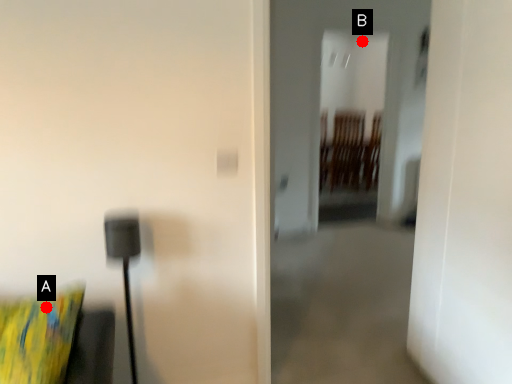
Question: Two points are circled on the image, labeled by A and B beside each circle. Which point is further to the camera?

Choices:
 (A) A is further
 (B) B is further

Answer: (B)